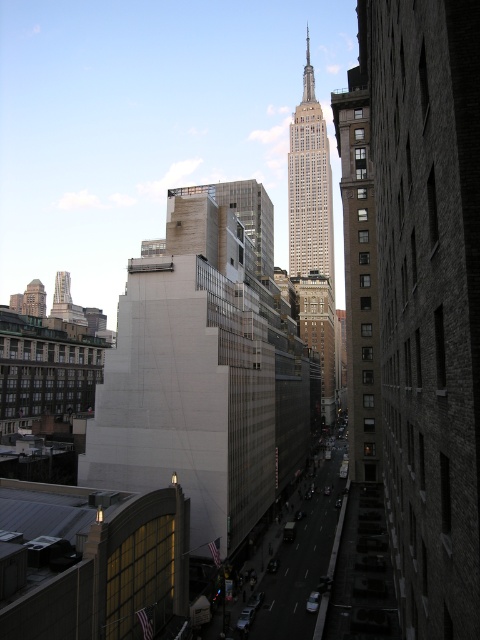
Question: Is white concrete building at center behind gray stone tower at center?

Choices:
 (A) no
 (B) yes

Answer: (A)

Question: Which of the following is the farthest from the observer?

Choices:
 (A) white concrete building at center
 (B) gray stone tower at center

Answer: (B)

Question: Is brown brick building at right above gray stone tower at center?

Choices:
 (A) yes
 (B) no

Answer: (B)

Question: Which point appears closest to the camera in this image?

Choices:
 (A) (359, 88)
 (B) (240, 538)
 (C) (324, 204)

Answer: (B)

Question: Which is farther from the white concrete building at center?

Choices:
 (A) gray stone tower at center
 (B) brown brick building at right

Answer: (A)

Question: Can you confirm if white concrete building at center is positioned above brown brick building at right?

Choices:
 (A) yes
 (B) no

Answer: (B)